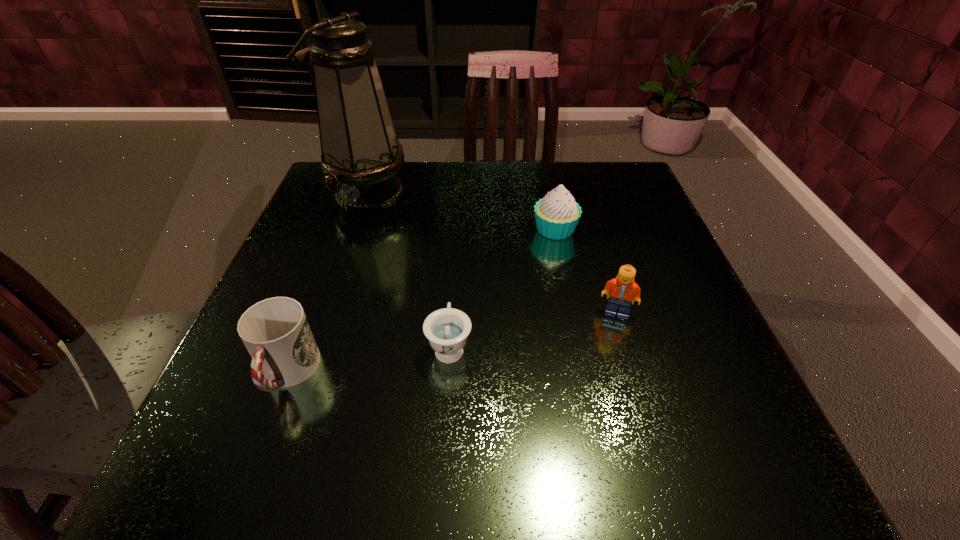
Locate an element on the screen. vacant region between the third farthest object and the fourth nearest object is located at coordinates (586, 271).

Identify the location of free space that is in between the second farthest object and the cup. (421, 301).

At what (x,y) coordinates should I click in order to perform the action: click on the third closest object to the oil lamp. Please return your answer as a coordinate pair (x, y). The image size is (960, 540). Looking at the image, I should click on [275, 331].

At what (x,y) coordinates should I click in order to perform the action: click on object identified as the closest to the Lego. Please return your answer as a coordinate pair (x, y). Image resolution: width=960 pixels, height=540 pixels. Looking at the image, I should click on (557, 214).

Find the location of a particular element. This screenshot has width=960, height=540. blank area in the image that satisfies the following two spatial constraints: 1. on the front side of the cupcake; 2. on the left side of the farthest object is located at coordinates (354, 230).